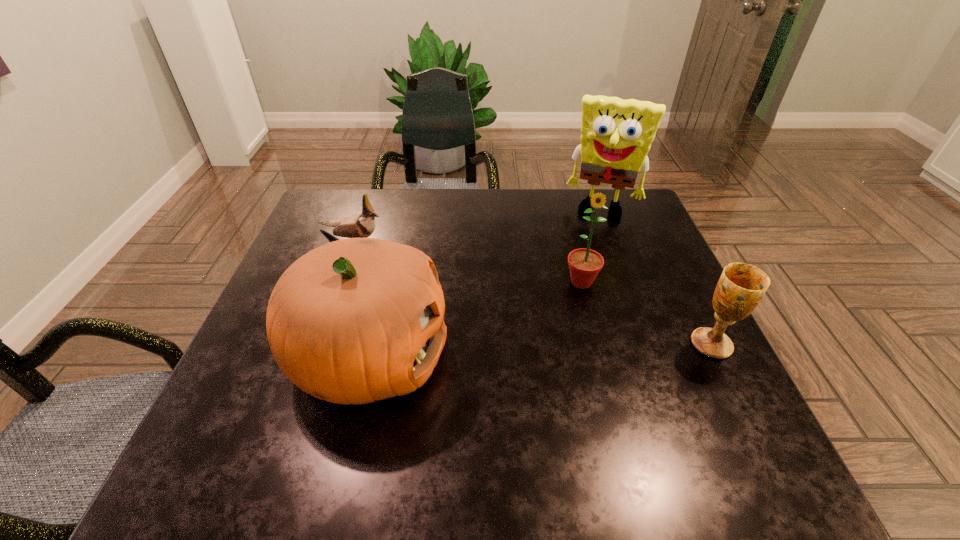
Identify the location of vacant space on the desktop that is between the pumpkin and the chalice and is positioned on the face of the sunflower. (570, 349).

This screenshot has height=540, width=960. I want to click on free space on the desktop that is between the pumpkin and the chalice and is positioned on the face of the farthest object, so click(559, 349).

Where is `free space on the desktop that is between the pumpkin and the chalice and is positioned at the face of the bird`? The height and width of the screenshot is (540, 960). free space on the desktop that is between the pumpkin and the chalice and is positioned at the face of the bird is located at coordinates (578, 349).